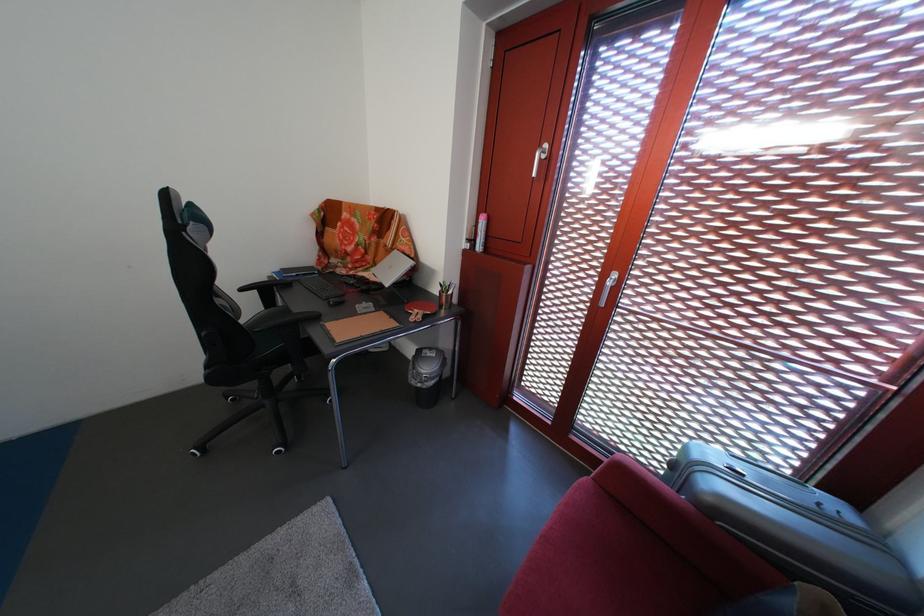
Where is `black chair sitting surface`? The width and height of the screenshot is (924, 616). black chair sitting surface is located at coordinates (265, 317).